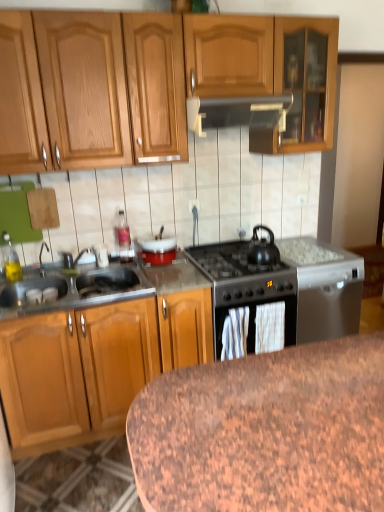
Question: From a real-world perspective, is translucent glass bottle at upper center, the 1th appliance positioned from the left, located beneath black matte gas stove at center?

Choices:
 (A) yes
 (B) no

Answer: (B)

Question: From a real-world perspective, is translucent glass bottle at upper center, the 1th appliance positioned from the left, positioned over black matte gas stove at center based on gravity?

Choices:
 (A) yes
 (B) no

Answer: (A)

Question: Does translucent glass bottle at upper center, which ranks as the third appliance in right-to-left order, have a larger size compared to black matte gas stove at center?

Choices:
 (A) yes
 (B) no

Answer: (B)

Question: Is translucent glass bottle at upper center, which ranks as the third appliance in right-to-left order, positioned with its back to black matte gas stove at center?

Choices:
 (A) no
 (B) yes

Answer: (A)

Question: Is translucent glass bottle at upper center, which ranks as the third appliance in right-to-left order, closer to the viewer compared to black matte gas stove at center?

Choices:
 (A) yes
 (B) no

Answer: (B)

Question: Is translucent glass bottle at upper center, which ranks as the third appliance in right-to-left order, positioned behind black matte gas stove at center?

Choices:
 (A) no
 (B) yes

Answer: (B)

Question: From a real-world perspective, is granite table at lower center below metallic gray dishwasher at right, which ranks as the 3th appliance in left-to-right order?

Choices:
 (A) no
 (B) yes

Answer: (A)

Question: Can you confirm if granite table at lower center is smaller than metallic gray dishwasher at right, which is counted as the 1th appliance, starting from the right?

Choices:
 (A) no
 (B) yes

Answer: (A)

Question: From the image's perspective, does granite table at lower center appear higher than metallic gray dishwasher at right, which ranks as the 3th appliance in left-to-right order?

Choices:
 (A) no
 (B) yes

Answer: (A)

Question: Is metallic gray dishwasher at right, which ranks as the 3th appliance in left-to-right order, at the back of granite table at lower center?

Choices:
 (A) no
 (B) yes

Answer: (B)

Question: Considering the relative sizes of granite table at lower center and metallic gray dishwasher at right, which ranks as the 3th appliance in left-to-right order, in the image provided, is granite table at lower center bigger than metallic gray dishwasher at right, which ranks as the 3th appliance in left-to-right order,?

Choices:
 (A) no
 (B) yes

Answer: (B)

Question: Can you confirm if granite table at lower center is positioned to the left of metallic gray dishwasher at right, which ranks as the 3th appliance in left-to-right order?

Choices:
 (A) no
 (B) yes

Answer: (B)

Question: Would you consider brushed metal faucet at sink left to be distant from metallic gray dishwasher at right, which is counted as the 1th appliance, starting from the right?

Choices:
 (A) no
 (B) yes

Answer: (B)